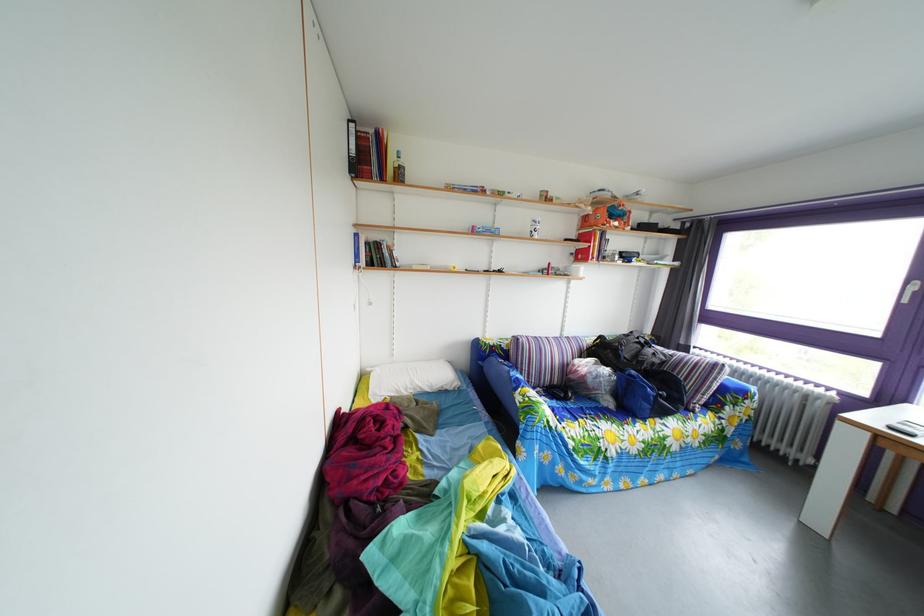
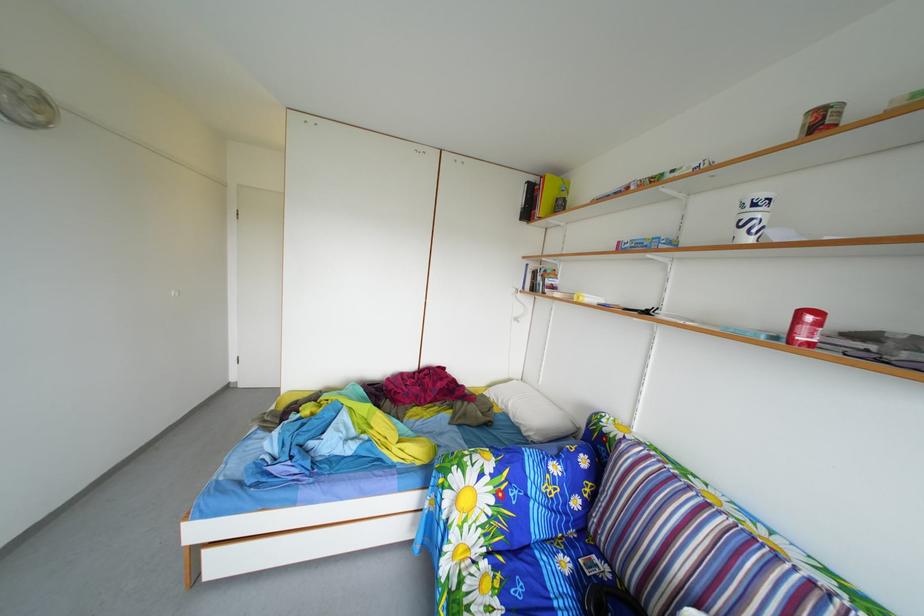
Find the pixel in the second image that matches [562,437] in the first image.

(453, 507)